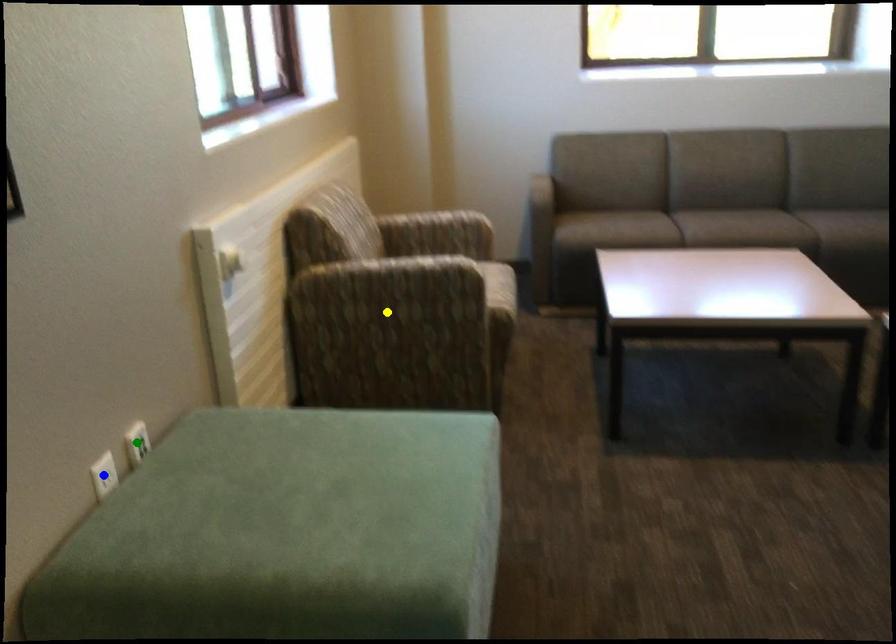
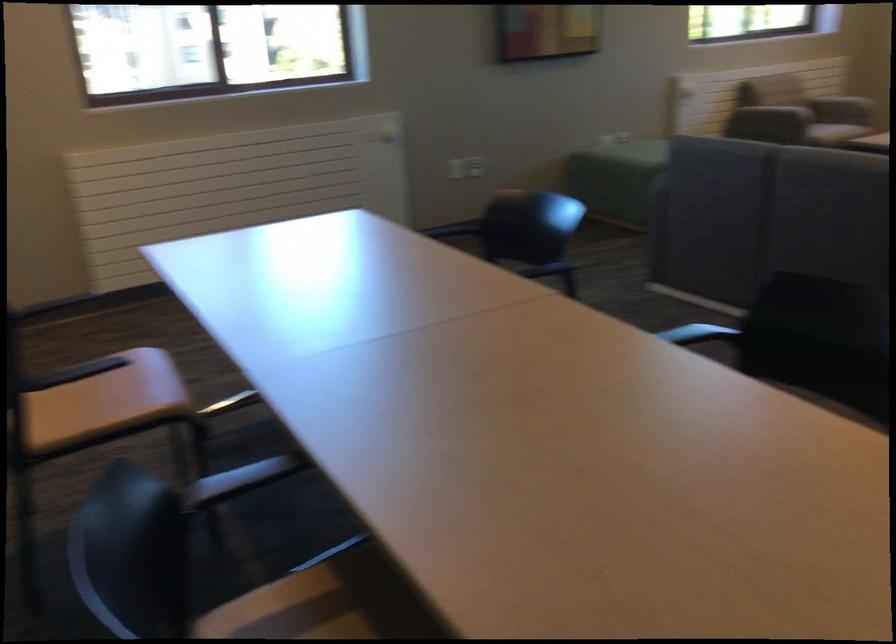
I am providing you with two images of the same scene from different viewpoints. Three points are marked in image1. Which point corresponds to a part or object that is occluded in image2?In image1, three points are marked. Which of them correspond to a part or object that is occluded in image2?Among the three points shown in image1, which one corresponds to a part or object that is no longer visible due to occlusion in image2?

yellow point, green point, blue point